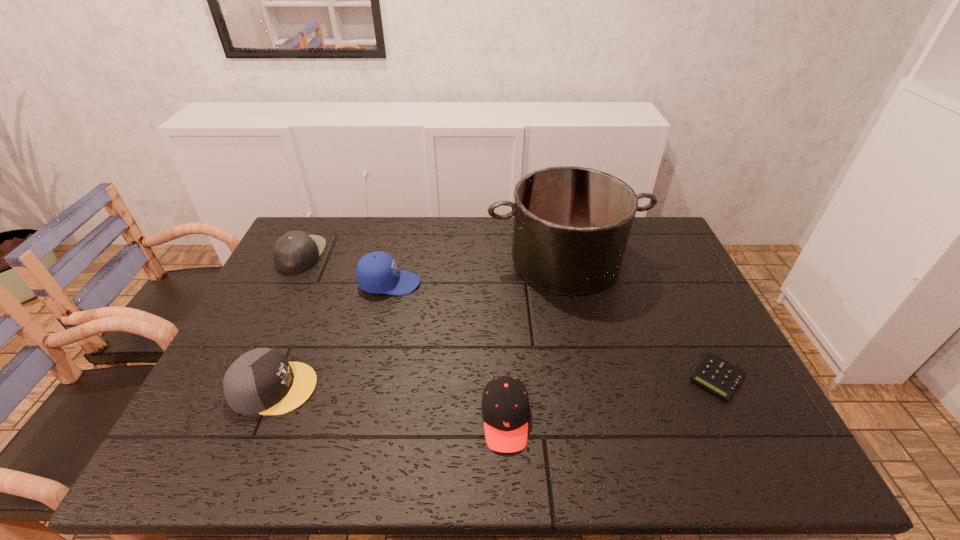
I want to click on free space at the near left corner, so click(221, 464).

The width and height of the screenshot is (960, 540). I want to click on free space between the tallest object and the shortest object, so coord(641,319).

Locate an element on the screen. This screenshot has height=540, width=960. unoccupied area between the shortest object and the pan is located at coordinates (641, 319).

Locate an element on the screen. vacant space that is in between the shortest object and the tallest object is located at coordinates (641, 319).

Where is `free spot between the tallest object and the shortest cap`? This screenshot has height=540, width=960. free spot between the tallest object and the shortest cap is located at coordinates (536, 340).

Locate which object ranks fifth in proximity to the second cap from right to left. Please provide its 2D coordinates. Your answer should be formatted as a tuple, i.e. [(x, y)], where the tuple contains the x and y coordinates of a point satisfying the conditions above.

[(715, 374)]

The width and height of the screenshot is (960, 540). What are the coordinates of `object that is the second closest to the calculator` in the screenshot? It's located at (505, 406).

Identify the location of cap identified as the second closest to the shortest cap. [262, 381].

Locate which cap is the closest to the rightmost cap. Please provide its 2D coordinates. Your answer should be formatted as a tuple, i.e. [(x, y)], where the tuple contains the x and y coordinates of a point satisfying the conditions above.

[(377, 272)]

The width and height of the screenshot is (960, 540). What are the coordinates of `vacant point that satisfies the following two spatial constraints: 1. on the front-facing side of the second cap from right to left; 2. on the right side of the calculator` in the screenshot? It's located at (369, 377).